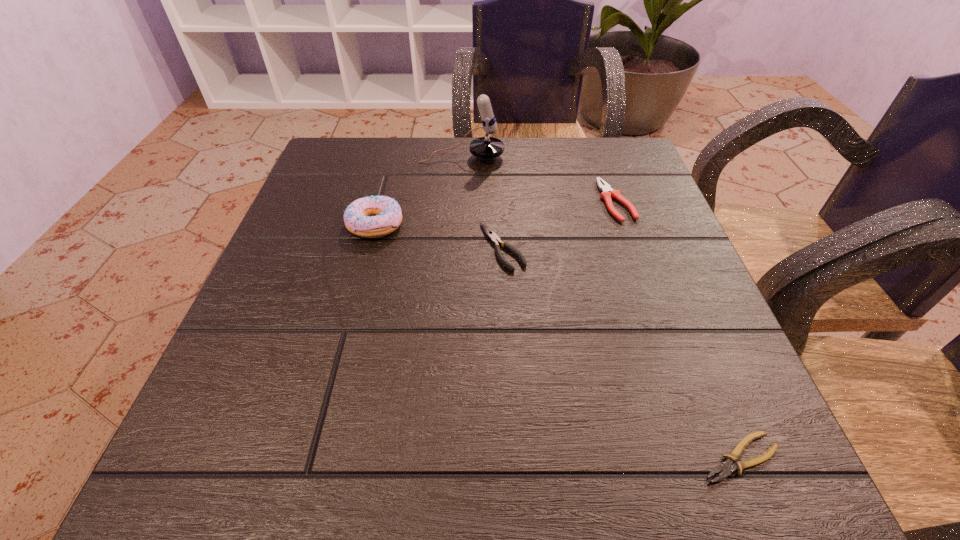
This screenshot has width=960, height=540. Identify the location of free space that is in between the farthest pliers and the leftmost pliers. (559, 224).

Locate an element on the screen. free space between the tallest object and the second nearest pliers is located at coordinates (482, 202).

This screenshot has width=960, height=540. I want to click on free space between the shortest object and the farthest pliers, so click(678, 329).

This screenshot has height=540, width=960. I want to click on free space that is in between the farthest pliers and the leftmost object, so click(x=495, y=213).

I want to click on vacant space that is in between the farthest pliers and the nearest object, so click(678, 329).

The width and height of the screenshot is (960, 540). Identify the location of unoccupied area between the shortest object and the microphone. (601, 307).

I want to click on free point between the second farthest pliers and the tallest object, so click(x=482, y=202).

Locate an element on the screen. The height and width of the screenshot is (540, 960). object that ranks as the second closest to the farthest pliers is located at coordinates (486, 147).

Where is `object that ranks as the third closest to the farthest object`? This screenshot has width=960, height=540. object that ranks as the third closest to the farthest object is located at coordinates (491, 235).

You are a GUI agent. You are given a task and a screenshot of the screen. Output one action in this format:
    pyautogui.click(x=<x>, y=<y>)
    Task: Click on the pliers object that ranks as the second closest to the farthest object
    
    Given the screenshot: What is the action you would take?
    pyautogui.click(x=491, y=235)